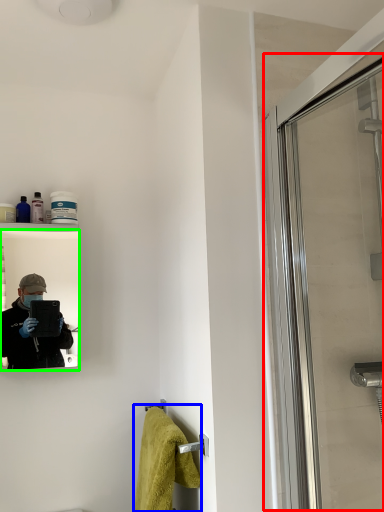
Question: Considering the real-world distances, which object is closest to screen door (highlighted by a red box)? bath towel (highlighted by a blue box) or mirror (highlighted by a green box).

Choices:
 (A) bath towel
 (B) mirror

Answer: (A)